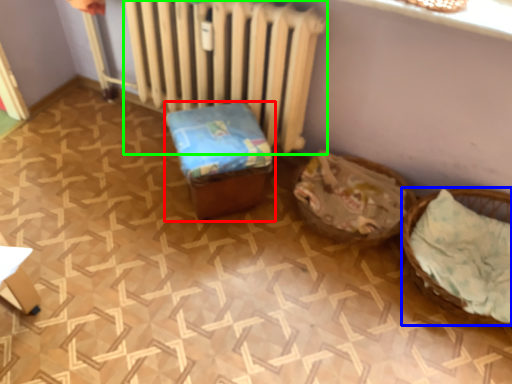
Question: Considering the real-world distances, which object is farthest from furniture (highlighted by a red box)? basket (highlighted by a blue box) or radiator (highlighted by a green box)?

Choices:
 (A) basket
 (B) radiator

Answer: (A)